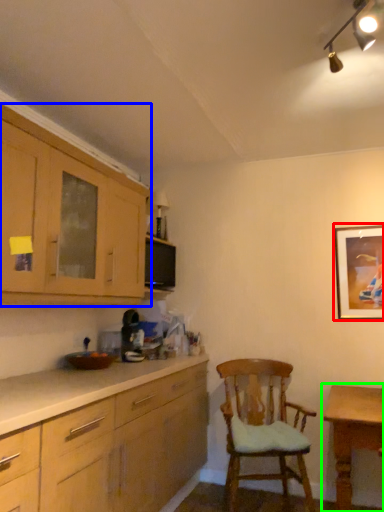
Question: Which object is positioned farthest from picture frame (highlighted by a red box)? Select from cabinetry (highlighted by a blue box) and table (highlighted by a green box).

Choices:
 (A) cabinetry
 (B) table

Answer: (A)